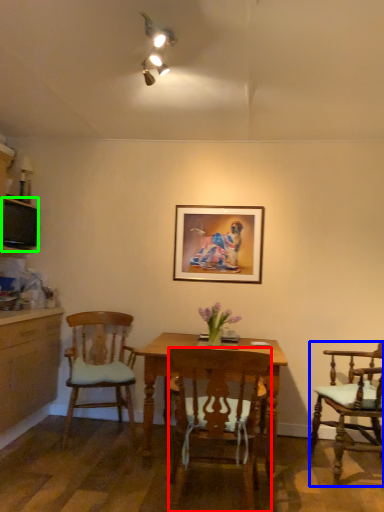
Question: Considering the real-world distances, which object is closest to chair (highlighted by a red box)? chair (highlighted by a blue box) or television (highlighted by a green box).

Choices:
 (A) chair
 (B) television

Answer: (A)